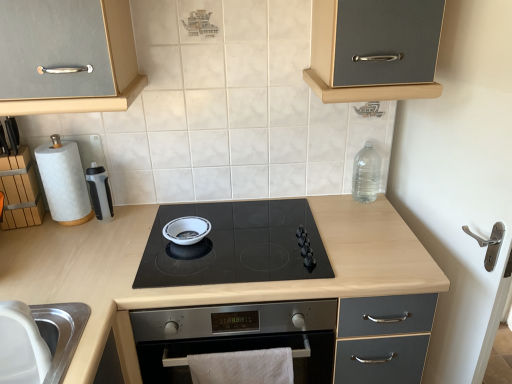
Where is `free location to the right of black plastic water bottle at left`? free location to the right of black plastic water bottle at left is located at coordinates (137, 224).